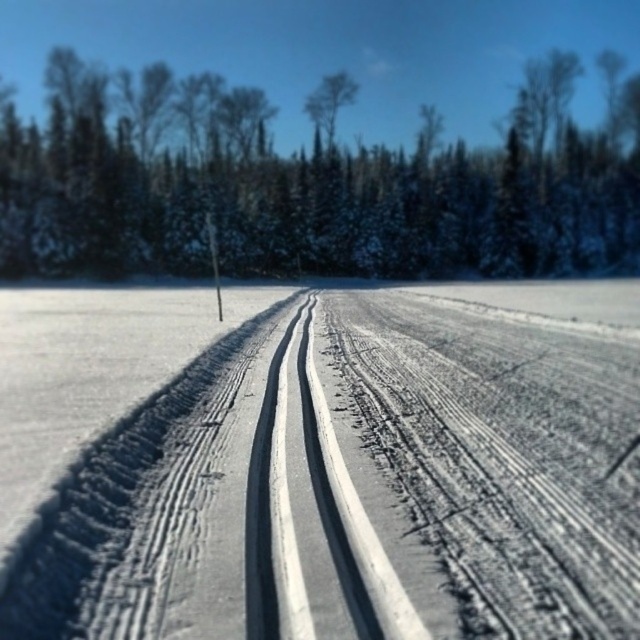
From the picture: Is gray textured dirt track at center thinner than green textured trees at center?

Indeed, gray textured dirt track at center has a lesser width compared to green textured trees at center.

Who is higher up, gray textured dirt track at center or green textured trees at center?

green textured trees at center is higher up.

Describe the element at coordinates (317, 465) in the screenshot. The width and height of the screenshot is (640, 640). I see `gray textured dirt track at center` at that location.

The width and height of the screenshot is (640, 640). Find the location of `gray textured dirt track at center`. gray textured dirt track at center is located at coordinates (317, 465).

Is point (196, 273) in front of point (317, 120)?

Yes.

Which is more to the left, green textured trees at center or green leafy tree at center?

Positioned to the left is green leafy tree at center.

Between point (310, 164) and point (328, 77), which one is positioned behind?

The point (328, 77) is behind.

This screenshot has width=640, height=640. I want to click on green textured trees at center, so click(x=300, y=198).

Who is more forward, (72, 432) or (328, 140)?

Positioned in front is point (72, 432).

Who is more distant from viewer, (356, 436) or (314, 109)?

Positioned behind is point (314, 109).

Which is behind, point (621, 630) or point (340, 96)?

Positioned behind is point (340, 96).

Locate an element on the screen. Image resolution: width=640 pixels, height=640 pixels. gray textured dirt track at center is located at coordinates (x=317, y=465).